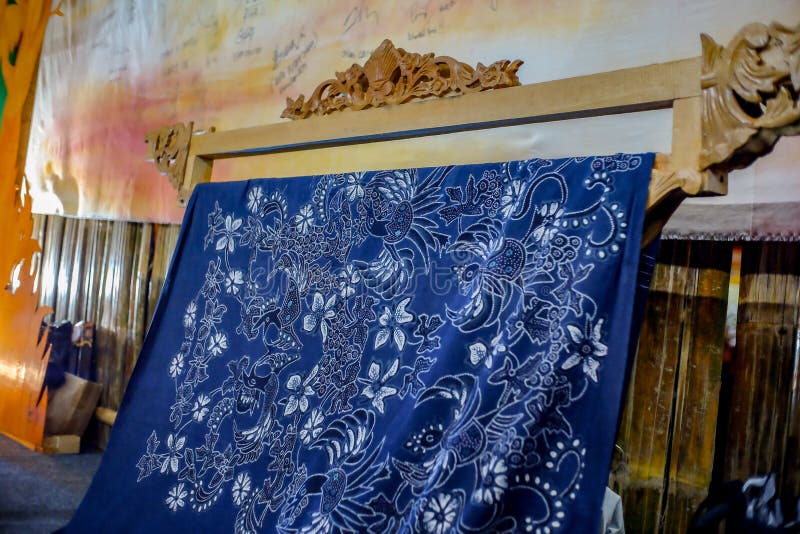
Locate an element on the screen. This screenshot has width=800, height=534. wood panel is located at coordinates (86, 264), (698, 343).